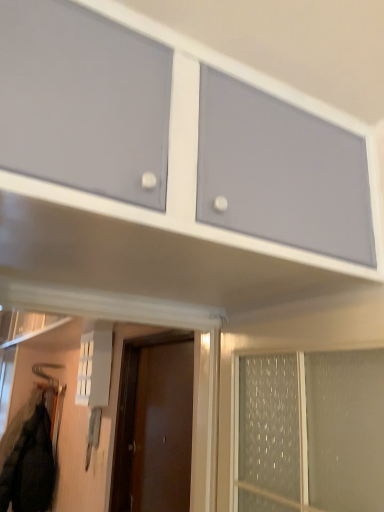
The image size is (384, 512). What do you see at coordinates (132, 411) in the screenshot?
I see `brown matte door at center` at bounding box center [132, 411].

The height and width of the screenshot is (512, 384). What are the coordinates of `black matte jacket at lower left` in the screenshot? It's located at pos(30,466).

Image resolution: width=384 pixels, height=512 pixels. What do you see at coordinates (256, 86) in the screenshot?
I see `matte gray cabinet at upper center` at bounding box center [256, 86].

The height and width of the screenshot is (512, 384). I want to click on brown matte door at center, so click(132, 411).

Between black matte jacket at lower left and matte gray cabinet at upper center, which one is positioned in front?

matte gray cabinet at upper center is in front.

Which is more distant, (22, 454) or (161, 22)?

The point (22, 454) is farther from the camera.

Can you confirm if black matte jacket at lower left is wider than matte gray cabinet at upper center?

No, black matte jacket at lower left is not wider than matte gray cabinet at upper center.

Which of these two, matte gray cabinet at upper center or black matte jacket at lower left, is smaller?

black matte jacket at lower left is smaller.

Is matte gray cabinet at upper center thinner than black matte jacket at lower left?

Incorrect, the width of matte gray cabinet at upper center is not less than that of black matte jacket at lower left.

Who is shorter, matte gray cabinet at upper center or black matte jacket at lower left?

Standing shorter between the two is matte gray cabinet at upper center.

Is matte gray cabinet at upper center facing away from black matte jacket at lower left?

matte gray cabinet at upper center does not have its back to black matte jacket at lower left.

In the scene shown: Is brown matte door at center wider or thinner than matte gray cabinet at upper center?

brown matte door at center is thinner than matte gray cabinet at upper center.

Can you confirm if brown matte door at center is taller than matte gray cabinet at upper center?

Correct, brown matte door at center is much taller as matte gray cabinet at upper center.

Can you tell me how much brown matte door at center and matte gray cabinet at upper center differ in facing direction?

There is a 90.1-degree angle between the facing directions of brown matte door at center and matte gray cabinet at upper center.

From a real-world perspective, does brown matte door at center sit lower than matte gray cabinet at upper center?

Indeed, from a real-world perspective, brown matte door at center is positioned beneath matte gray cabinet at upper center.

Can you confirm if black matte jacket at lower left is positioned to the left of brown matte door at center?

Yes, black matte jacket at lower left is to the left of brown matte door at center.

From the image's perspective, would you say black matte jacket at lower left is shown under brown matte door at center?

Indeed, from the image's perspective, black matte jacket at lower left is shown beneath brown matte door at center.

Are black matte jacket at lower left and brown matte door at center located far from each other?

black matte jacket at lower left is positioned a significant distance from brown matte door at center.

Which is less distant, (15, 492) or (136, 389)?

Point (136, 389)

Could brown matte door at center be considered to be inside matte gray cabinet at upper center?

No, brown matte door at center is not a part of matte gray cabinet at upper center.

The image size is (384, 512). Identify the location of cabinetry positioned vertically above the brown matte door at center (from a real-world perspective). (256, 86).

Can you confirm if matte gray cabinet at upper center is smaller than brown matte door at center?

Incorrect, matte gray cabinet at upper center is not smaller in size than brown matte door at center.

Is matte gray cabinet at upper center wider than brown matte door at center?

Correct, the width of matte gray cabinet at upper center exceeds that of brown matte door at center.

Which of these two, brown matte door at center or black matte jacket at lower left, stands taller?

brown matte door at center.

Could you tell me if brown matte door at center is turned towards black matte jacket at lower left?

No, brown matte door at center is not oriented towards black matte jacket at lower left.

From the image's perspective, is brown matte door at center under black matte jacket at lower left?

Incorrect, from the image's perspective, brown matte door at center is higher than black matte jacket at lower left.

In the scene shown: How distant is brown matte door at center from black matte jacket at lower left?

They are 3.64 feet apart.

Where is `cabinetry on the right of the black matte jacket at lower left`? cabinetry on the right of the black matte jacket at lower left is located at coordinates (256, 86).

There is a black matte jacket at lower left. Where is `cabinetry above it (from a real-world perspective)`? The height and width of the screenshot is (512, 384). cabinetry above it (from a real-world perspective) is located at coordinates (256, 86).

Considering their positions, is black matte jacket at lower left positioned further to matte gray cabinet at upper center than brown matte door at center?

black matte jacket at lower left is positioned further to the anchor matte gray cabinet at upper center.

Estimate the real-world distances between objects in this image. Which object is further from brown matte door at center, black matte jacket at lower left or matte gray cabinet at upper center?

matte gray cabinet at upper center is positioned further to the anchor brown matte door at center.

When comparing their distances from black matte jacket at lower left, does brown matte door at center or matte gray cabinet at upper center seem closer?

brown matte door at center is closer to black matte jacket at lower left.

When comparing their distances from brown matte door at center, does matte gray cabinet at upper center or black matte jacket at lower left seem closer?

black matte jacket at lower left is closer to brown matte door at center.

Considering their positions, is matte gray cabinet at upper center positioned further to black matte jacket at lower left than brown matte door at center?

matte gray cabinet at upper center lies further to black matte jacket at lower left than the other object.

Considering their positions, is brown matte door at center positioned closer to matte gray cabinet at upper center than black matte jacket at lower left?

brown matte door at center.

In order to click on door between matte gray cabinet at upper center and black matte jacket at lower left in the front-back direction in this screenshot , I will do `click(132, 411)`.